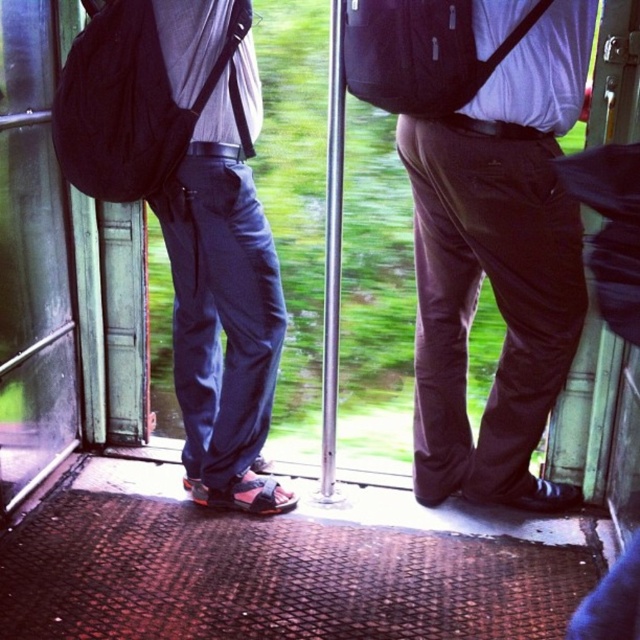
You are standing inside a moving train and want to reach the point marked at coordinates point (179,120). If you can stretch your arm 1.8 meters, can you safely touch that point without stepping forward?

The distance of point (179,120) from viewer is 1.98 meters, so stretching your arm 1.8 meters would not be enough to reach it. You need to step forward to touch it.

You are a passenger on the train and need to store your backpack. You see two matte black backpacks in the scene. Which one is wider, the matte black backpack at left or the matte black backpack at center?

The matte black backpack at left might be wider than matte black backpack at center according to the description.

You are on a moving train and need to place a new seat at point [124,104]. What object is located there?

The point [124,104] corresponds to the matte black backpack at left.